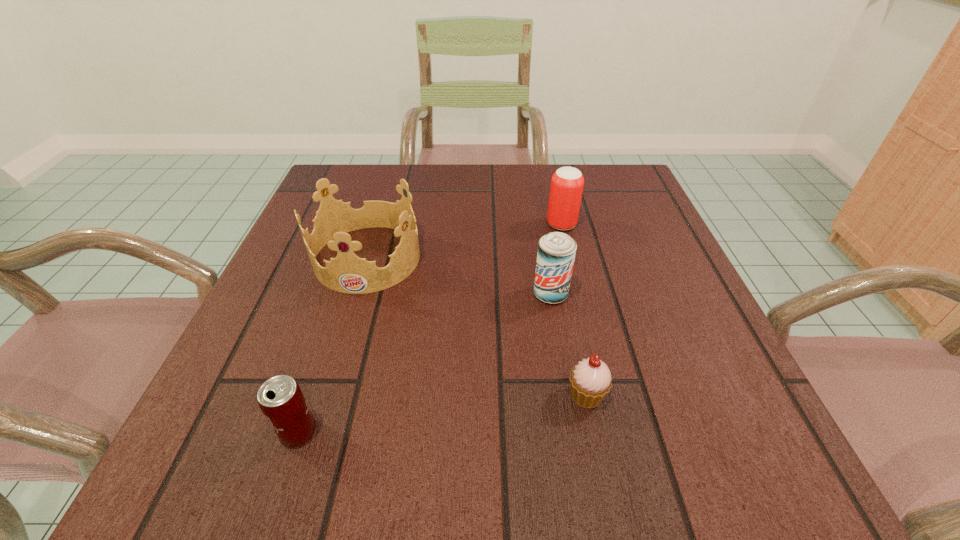
Identify the location of vacant region between the second nearest object and the second farthest beer can. The width and height of the screenshot is (960, 540). (568, 345).

Select which object appears as the second closest to the leftmost beer can. Please provide its 2D coordinates. Your answer should be formatted as a tuple, i.e. [(x, y)], where the tuple contains the x and y coordinates of a point satisfying the conditions above.

[(590, 380)]

Identify which object is located as the third nearest to the second nearest object. Please provide its 2D coordinates. Your answer should be formatted as a tuple, i.e. [(x, y)], where the tuple contains the x and y coordinates of a point satisfying the conditions above.

[(281, 400)]

Find the location of `beer can that stands as the closest to the tiara`. beer can that stands as the closest to the tiara is located at coordinates (556, 253).

Select which beer can appears as the third closest to the fourth farthest object. Please provide its 2D coordinates. Your answer should be formatted as a tuple, i.e. [(x, y)], where the tuple contains the x and y coordinates of a point satisfying the conditions above.

[(567, 183)]

The image size is (960, 540). In order to click on vacant point that satisfies the following two spatial constraints: 1. on the back side of the farthest beer can; 2. on the left side of the nearest object in this screenshot , I will do `click(367, 224)`.

Image resolution: width=960 pixels, height=540 pixels. Find the location of `free location that satisfies the following two spatial constraints: 1. on the front-facing side of the second nearest beer can; 2. on the left side of the tiara`. free location that satisfies the following two spatial constraints: 1. on the front-facing side of the second nearest beer can; 2. on the left side of the tiara is located at coordinates (357, 294).

I want to click on free space in the image that satisfies the following two spatial constraints: 1. on the front-facing side of the second nearest beer can; 2. on the left side of the tiara, so pyautogui.click(x=357, y=294).

The image size is (960, 540). I want to click on free spot that satisfies the following two spatial constraints: 1. on the front-facing side of the second farthest beer can; 2. on the right side of the tiara, so [357, 294].

Where is `free space that satisfies the following two spatial constraints: 1. on the front-facing side of the cupcake; 2. on the right side of the tiara`? The width and height of the screenshot is (960, 540). free space that satisfies the following two spatial constraints: 1. on the front-facing side of the cupcake; 2. on the right side of the tiara is located at coordinates (326, 395).